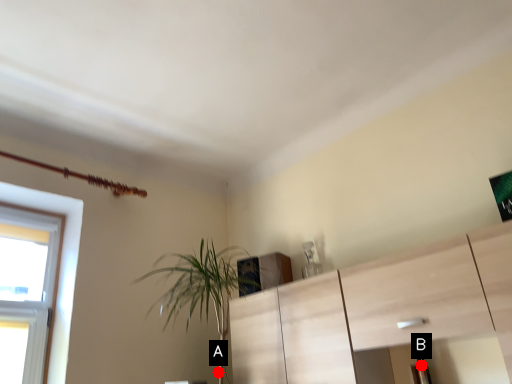
Question: Two points are circled on the image, labeled by A and B beside each circle. Which point appears closest to the camera in this image?

Choices:
 (A) A is closer
 (B) B is closer

Answer: (B)